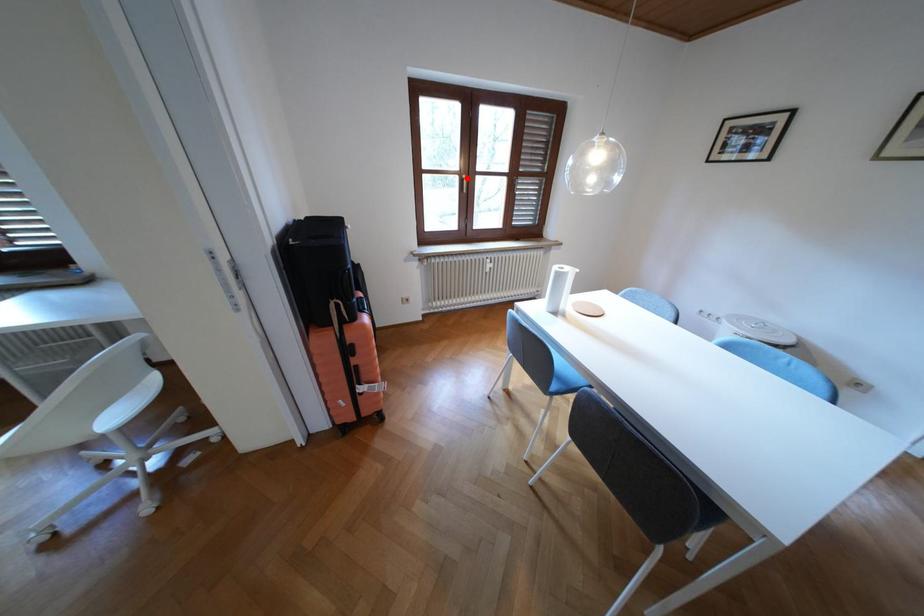
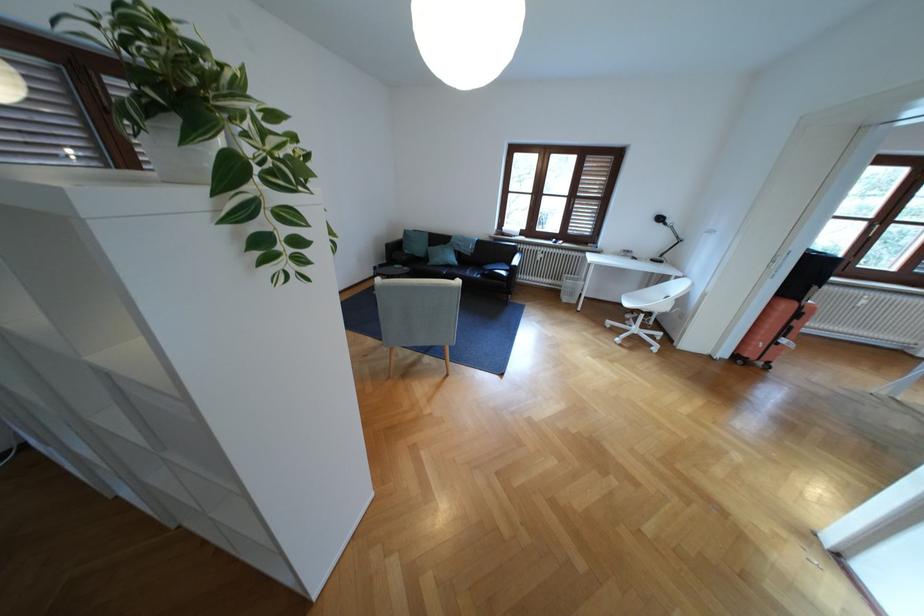
Question: I am providing you with two images of the same scene from different viewpoints. In image1, a red point is highlighted. Considering the same 3D point in image2, which of the following is correct?

Choices:
 (A) It is closer
 (B) It is farther

Answer: (B)